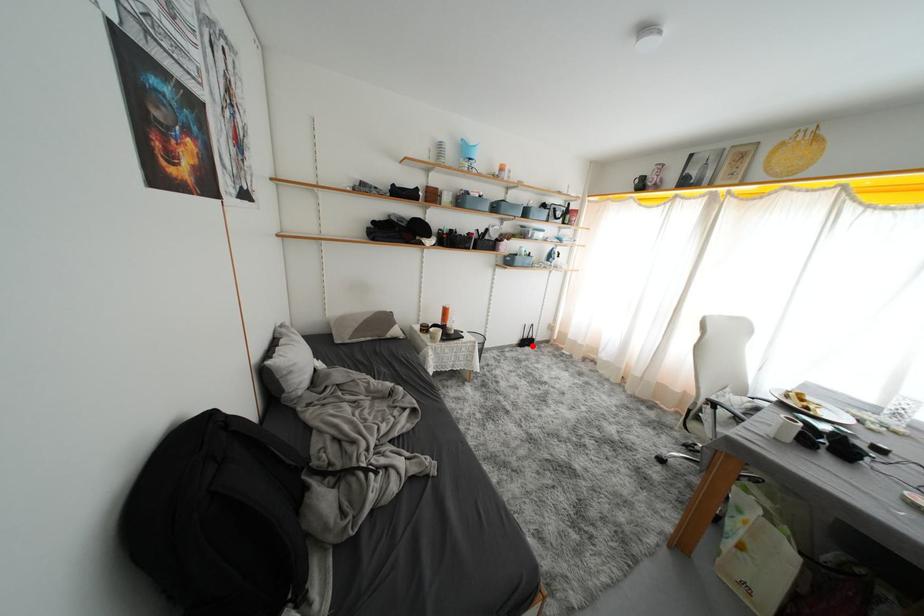
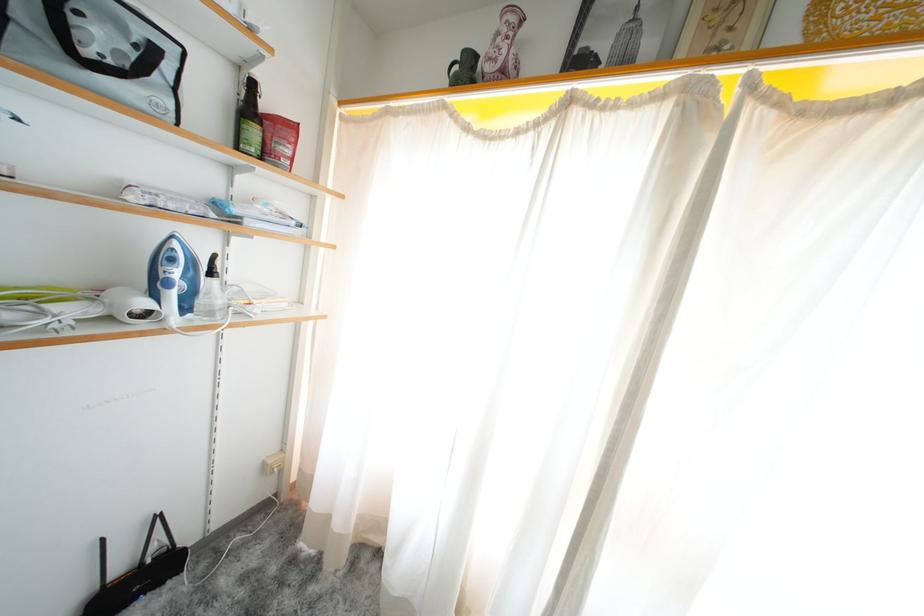
Where in the second image is the point corresponding to the highlighted location from the first image?

(143, 586)